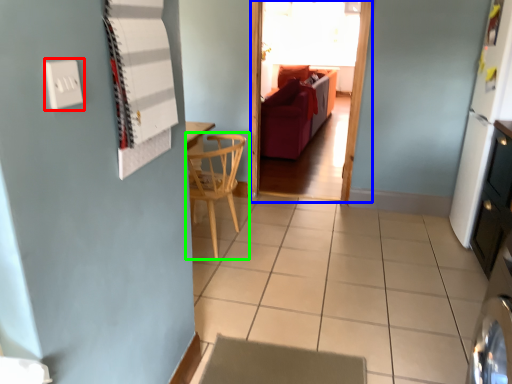
Question: Considering the real-world distances, which object is farthest from electric outlet (highlighted by a red box)? glass door (highlighted by a blue box) or chair (highlighted by a green box)?

Choices:
 (A) glass door
 (B) chair

Answer: (A)